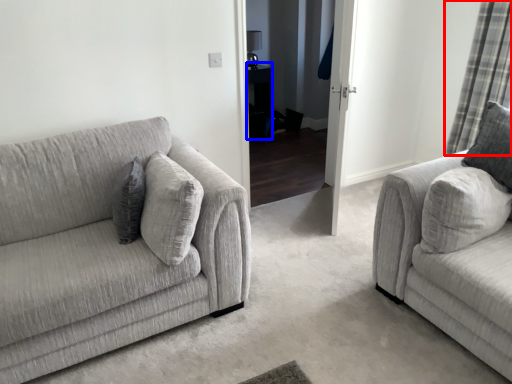
Question: Which point is further to the camera, curtain (highlighted by a red box) or table (highlighted by a blue box)?

Choices:
 (A) curtain
 (B) table

Answer: (B)